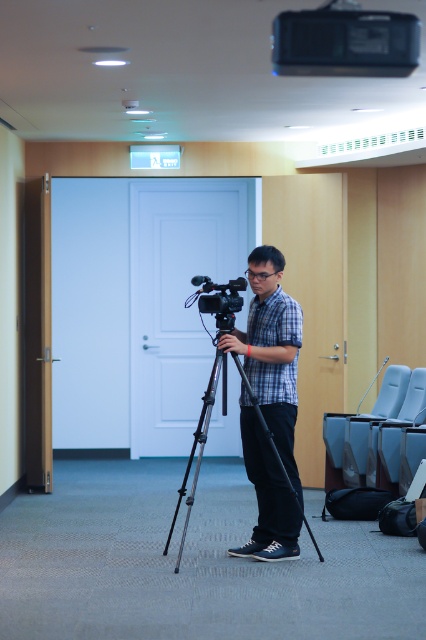
You are standing in the conference room and want to know how far the point at coordinates [296,342] is from you. Can you determine the distance?

The point at coordinates [296,342] is 6.31 meters away from you.

You are setting up a video call in the conference room. You need to ensure that the matte black camera at center is positioned exactly 1.00 meters away from the black metal tripod at center. Is this setup possible given the current spacing between them?

The black metal tripod at center and matte black camera at center are already 1.00 meters apart from each other, so the setup is already correctly positioned to meet the requirement.